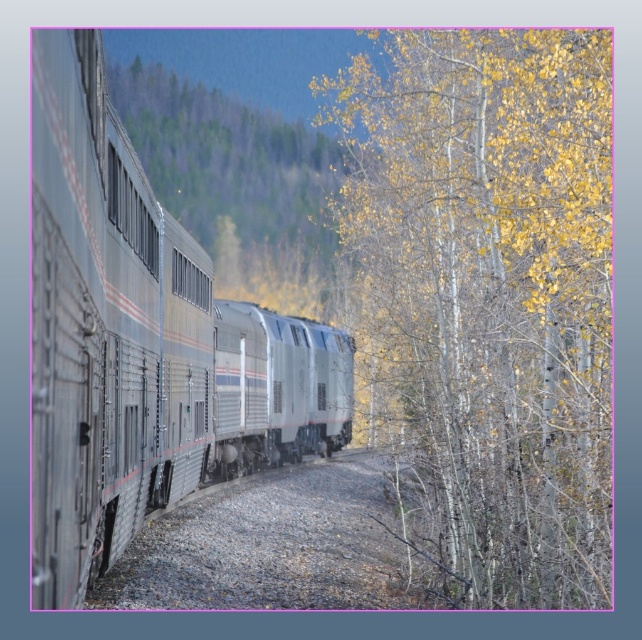
Looking at this image, you are a passenger on the silver metallic train at left. You look out the window and see the dense forested hills in the background. If you want to take a photo of the train and the hills together, where should you stand in the train to ensure both are in frame?

Since the silver metallic train at left is positioned at point (143, 342), you should stand near the front of the train to capture both the train and the distant hills in the background in a single frame.